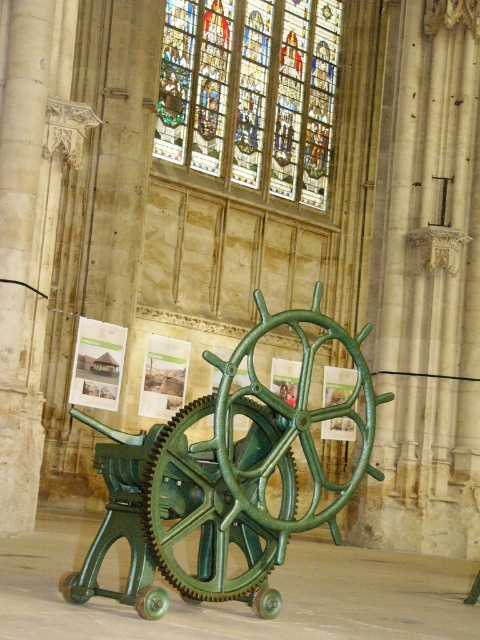
Is green polished metal gear at center below stained glass at upper center?

Yes.

Can you confirm if green polished metal gear at center is positioned to the left of stained glass at upper center?

Correct, you'll find green polished metal gear at center to the left of stained glass at upper center.

Where is `green polished metal gear at center`? The image size is (480, 640). green polished metal gear at center is located at coordinates (223, 480).